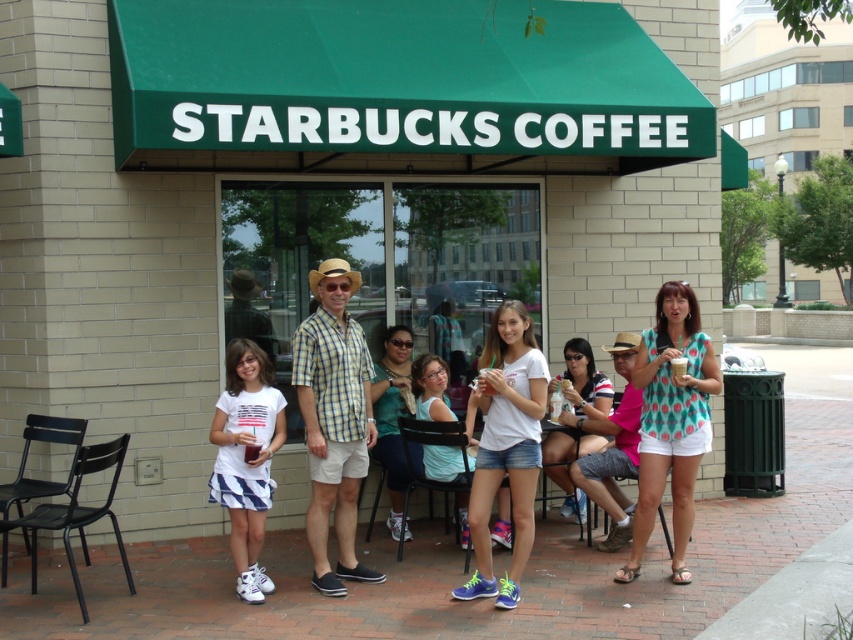
You are a photographer trying to capture a group photo of the yellow plaid shirt at center and the teal fabric shirt at center. Since you want to ensure both are clearly visible, which shirt should you focus on first to avoid blurring due to size differences?

The yellow plaid shirt at center is bigger than the teal fabric shirt at center, so focus on the yellow plaid shirt at center first to ensure it is in clear focus before adjusting for the smaller one.

You are a fashion designer observing the group outside the Starbucks. You notice the yellow plaid shirt at center and the matte black sunglasses at center. Which item has a smaller width when viewed from the front?

The yellow plaid shirt at center is thinner than the matte black sunglasses at center, so the yellow plaid shirt at center has a smaller width when viewed from the front.